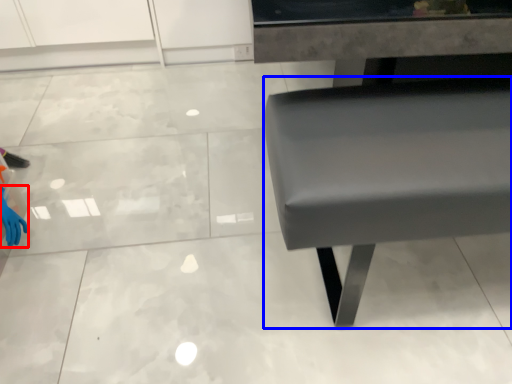
Question: Among these objects, which one is nearest to the camera, hand (highlighted by a red box) or furniture (highlighted by a blue box)?

Choices:
 (A) hand
 (B) furniture

Answer: (B)